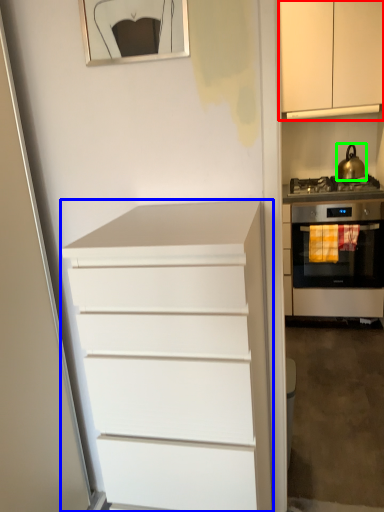
Question: Based on their relative distances, which object is nearer to cabinetry (highlighted by a red box)? Choose from chest of drawers (highlighted by a blue box) and kitchen appliance (highlighted by a green box).

Choices:
 (A) chest of drawers
 (B) kitchen appliance

Answer: (B)